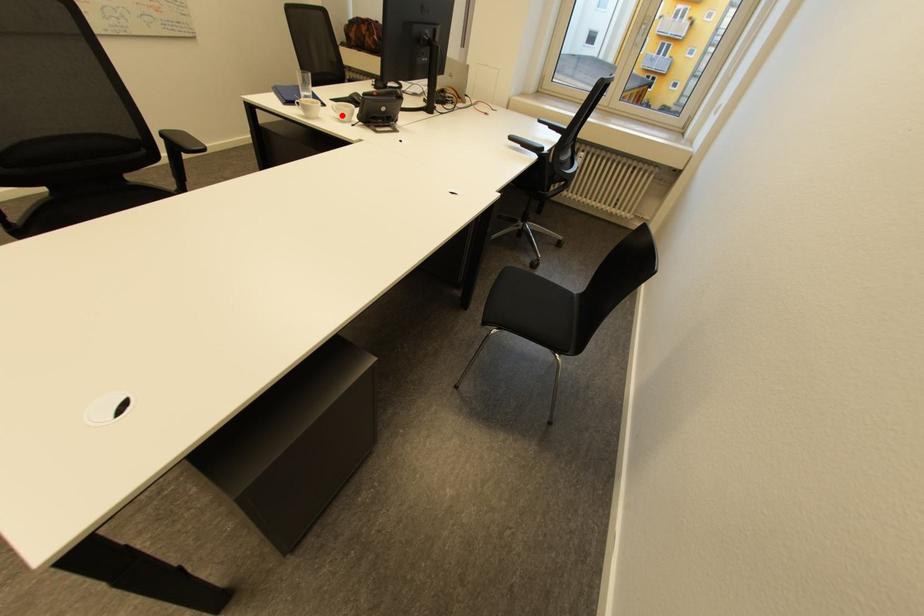
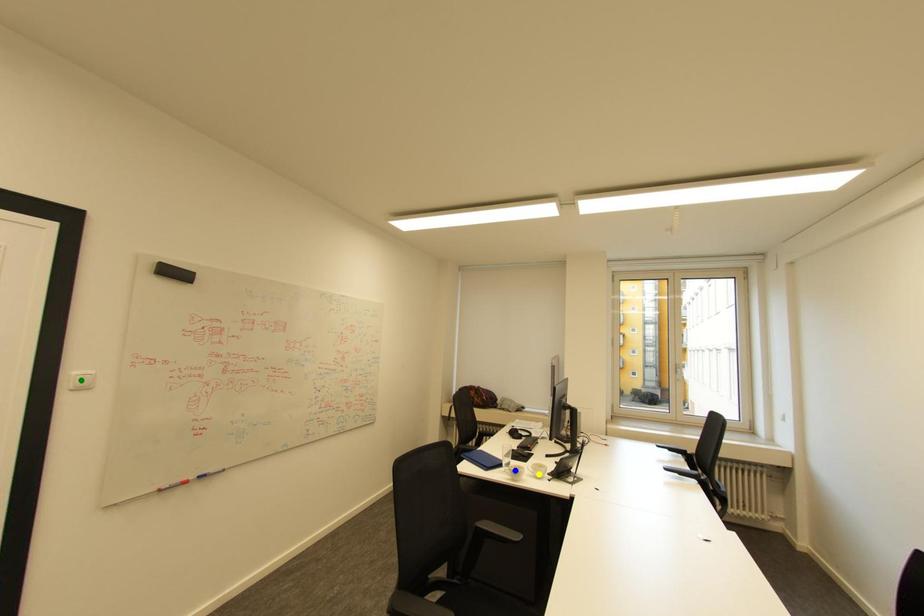
Question: I am providing you with two images of the same scene from different viewpoints. A red point is marked on the first image. You are given multiple points on the second image. In image 2, which mark is for the same physical point as the one in image 1?

Choices:
 (A) green point
 (B) yellow point
 (C) blue point

Answer: (B)